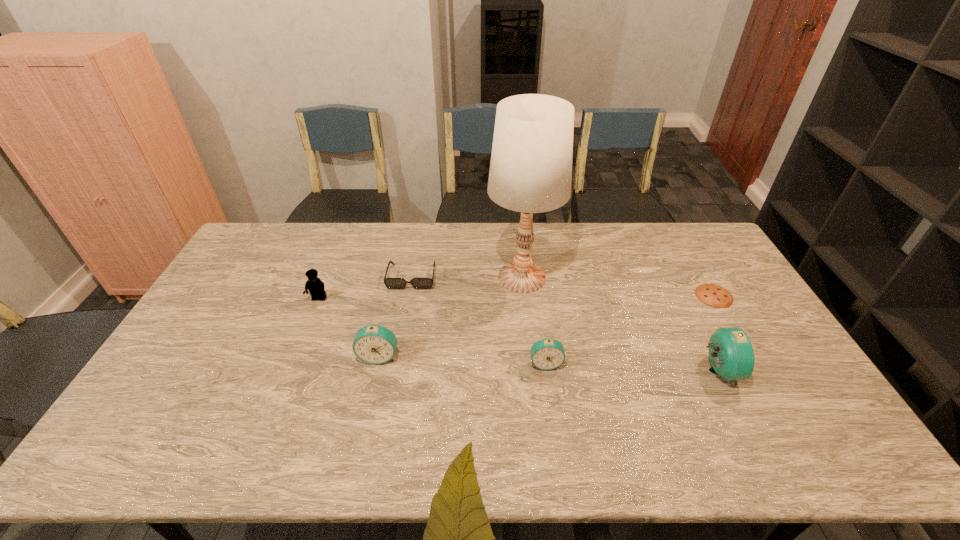
The height and width of the screenshot is (540, 960). I want to click on unoccupied position between the cookie and the sixth tallest object, so click(563, 286).

Where is `vacant space that is in between the sixth shortest object and the second alarm clock from left to right`? vacant space that is in between the sixth shortest object and the second alarm clock from left to right is located at coordinates (632, 367).

I want to click on object that ranks as the third closest to the Lego, so point(530,172).

Locate an element on the screen. The image size is (960, 540). the sixth closest object to the sunglasses is located at coordinates (713, 295).

The width and height of the screenshot is (960, 540). Find the location of `alarm clock that can be found as the third closest to the lamp`. alarm clock that can be found as the third closest to the lamp is located at coordinates (731, 354).

What are the coordinates of `the third closest alarm clock to the cookie` in the screenshot? It's located at (375, 344).

At what (x,y) coordinates should I click in order to perform the action: click on vacant region that satisfies the following two spatial constraints: 1. on the front-facing side of the shortest object; 2. on the right side of the sixth tallest object. Please return your answer as a coordinate pair (x, y). Looking at the image, I should click on (409, 296).